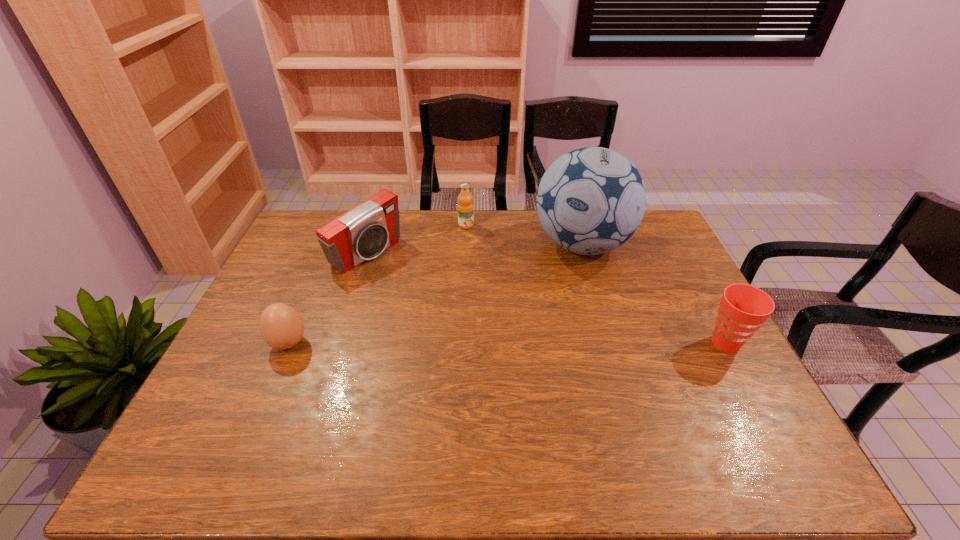
Where is `free space that is in between the camera and the second object from right to left`? Image resolution: width=960 pixels, height=540 pixels. free space that is in between the camera and the second object from right to left is located at coordinates (474, 249).

Where is `free point between the shortest object and the rightmost object`? This screenshot has width=960, height=540. free point between the shortest object and the rightmost object is located at coordinates (507, 343).

Image resolution: width=960 pixels, height=540 pixels. Identify the location of vacant area between the camera and the third object from right to left. (417, 240).

Find the location of `free space between the shortest object and the rightmost object`. free space between the shortest object and the rightmost object is located at coordinates (507, 343).

You are a GUI agent. You are given a task and a screenshot of the screen. Output one action in this format:
    pyautogui.click(x=<x>, y=<y>)
    Task: Click on the vacant space in between the orange juice and the cup
    
    Given the screenshot: What is the action you would take?
    pyautogui.click(x=596, y=285)

The width and height of the screenshot is (960, 540). Identify the location of free point between the third object from right to left and the rightmost object. (596, 285).

Image resolution: width=960 pixels, height=540 pixels. I want to click on free space between the second object from right to left and the camera, so click(474, 249).

At what (x,y) coordinates should I click in order to perform the action: click on empty space between the rightmost object and the camera. Please return your answer as a coordinate pair (x, y). The image size is (960, 540). Looking at the image, I should click on (546, 299).

Point out which object is positioned as the second nearest to the boiled egg. Please provide its 2D coordinates. Your answer should be formatted as a tuple, i.e. [(x, y)], where the tuple contains the x and y coordinates of a point satisfying the conditions above.

[(465, 206)]

Image resolution: width=960 pixels, height=540 pixels. In order to click on the second closest object to the camera in this screenshot , I will do `click(281, 326)`.